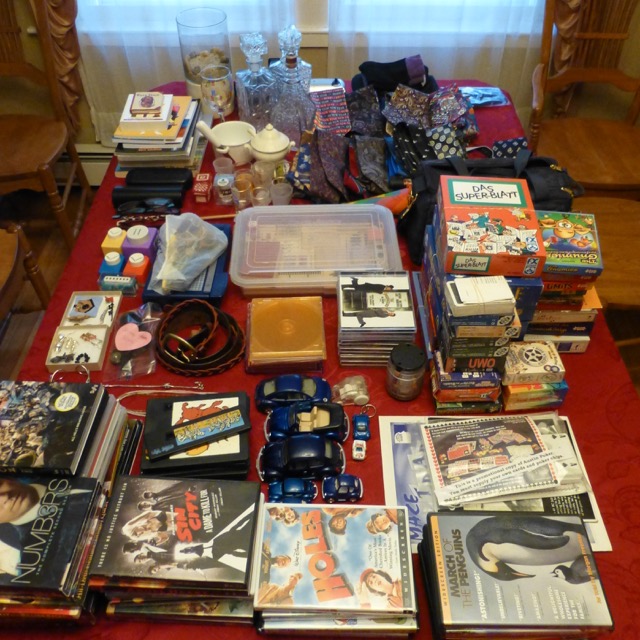
This screenshot has height=640, width=640. Find the location of `curtains`. curtains is located at coordinates (115, 45), (442, 25).